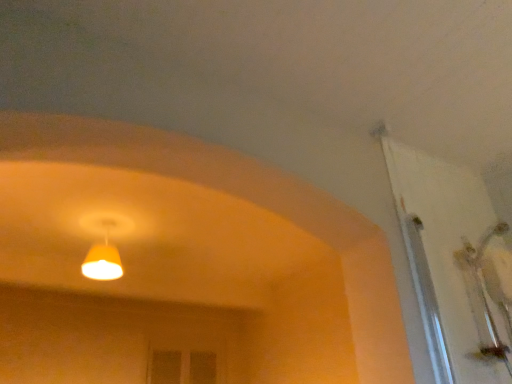
This screenshot has width=512, height=384. Find the location of `white glossy door at upper right`. white glossy door at upper right is located at coordinates (455, 264).

Describe the element at coordinates (455, 264) in the screenshot. I see `white glossy door at upper right` at that location.

Describe the element at coordinates (103, 258) in the screenshot. The image size is (512, 384). I see `yellow matte lampshade at upper center` at that location.

Find the location of `yellow matte lampshade at upper center`. yellow matte lampshade at upper center is located at coordinates (103, 258).

In the scene shown: In order to face yellow matte lampshade at upper center, should I rotate leftwards or rightwards?

Turn left approximately 19.184 degrees to face it.

At what (x,y) coordinates should I click in order to perform the action: click on white glossy door at upper right. Please return your answer as a coordinate pair (x, y). Looking at the image, I should click on (455, 264).

Considering the relative positions of white glossy door at upper right and yellow matte lampshade at upper center in the image provided, is white glossy door at upper right to the left of yellow matte lampshade at upper center from the viewer's perspective?

No.

Which is behind, white glossy door at upper right or yellow matte lampshade at upper center?

yellow matte lampshade at upper center is more distant.

Is point (424, 160) less distant than point (121, 272)?

That is True.

From the image's perspective, which object appears higher, white glossy door at upper right or yellow matte lampshade at upper center?

white glossy door at upper right appears higher in the image.

From a real-world perspective, is white glossy door at upper right under yellow matte lampshade at upper center?

Yes.

Considering the sizes of objects white glossy door at upper right and yellow matte lampshade at upper center in the image provided, who is wider, white glossy door at upper right or yellow matte lampshade at upper center?

With larger width is white glossy door at upper right.

From their relative heights in the image, would you say white glossy door at upper right is taller or shorter than yellow matte lampshade at upper center?

Clearly, white glossy door at upper right is taller compared to yellow matte lampshade at upper center.

Considering the relative sizes of white glossy door at upper right and yellow matte lampshade at upper center in the image provided, is white glossy door at upper right smaller than yellow matte lampshade at upper center?

Actually, white glossy door at upper right might be larger than yellow matte lampshade at upper center.

Would you say yellow matte lampshade at upper center is part of white glossy door at upper right's contents?

No, white glossy door at upper right does not contain yellow matte lampshade at upper center.

Is white glossy door at upper right directly adjacent to yellow matte lampshade at upper center?

No, white glossy door at upper right is not beside yellow matte lampshade at upper center.

Is white glossy door at upper right positioned with its back to yellow matte lampshade at upper center?

No, white glossy door at upper right is not facing away from yellow matte lampshade at upper center.

How many degrees apart are the facing directions of white glossy door at upper right and yellow matte lampshade at upper center?

white glossy door at upper right and yellow matte lampshade at upper center are facing 1.49 degrees away from each other.

How much distance is there between white glossy door at upper right and yellow matte lampshade at upper center?

A distance of 6.90 feet exists between white glossy door at upper right and yellow matte lampshade at upper center.

Where is `door on the right of yellow matte lampshade at upper center`? This screenshot has height=384, width=512. door on the right of yellow matte lampshade at upper center is located at coordinates (455, 264).

Is yellow matte lampshade at upper center to the left of white glossy door at upper right from the viewer's perspective?

Yes.

Is yellow matte lampshade at upper center in front of white glossy door at upper right?

No, it is behind white glossy door at upper right.

Does point (84, 274) lie behind point (459, 360)?

Yes, it is behind point (459, 360).

From the image's perspective, which one is positioned lower, yellow matte lampshade at upper center or white glossy door at upper right?

yellow matte lampshade at upper center.

From a real-world perspective, is yellow matte lampshade at upper center physically below white glossy door at upper right?

No, from a real-world perspective, yellow matte lampshade at upper center is not under white glossy door at upper right.

Considering the sizes of objects yellow matte lampshade at upper center and white glossy door at upper right in the image provided, who is wider, yellow matte lampshade at upper center or white glossy door at upper right?

With larger width is white glossy door at upper right.

Based on the photo, between yellow matte lampshade at upper center and white glossy door at upper right, which one has more height?

With more height is white glossy door at upper right.

Who is bigger, yellow matte lampshade at upper center or white glossy door at upper right?

white glossy door at upper right.

Is yellow matte lampshade at upper center positioned beyond the bounds of white glossy door at upper right?

yellow matte lampshade at upper center is positioned outside white glossy door at upper right.

Is yellow matte lampshade at upper center directly adjacent to white glossy door at upper right?

yellow matte lampshade at upper center is not next to white glossy door at upper right, and they're not touching.

Is yellow matte lampshade at upper center oriented away from white glossy door at upper right?

No, white glossy door at upper right is not at the back of yellow matte lampshade at upper center.

How much distance is there between yellow matte lampshade at upper center and white glossy door at upper right?

yellow matte lampshade at upper center and white glossy door at upper right are 6.90 feet apart.

Locate an element on the screen. This screenshot has height=384, width=512. door located above the yellow matte lampshade at upper center (from the image's perspective) is located at coordinates (455, 264).

The height and width of the screenshot is (384, 512). I want to click on door that is in front of the yellow matte lampshade at upper center, so click(455, 264).

Where is `door that appears above the yellow matte lampshade at upper center (from the image's perspective)`? The image size is (512, 384). door that appears above the yellow matte lampshade at upper center (from the image's perspective) is located at coordinates (455, 264).